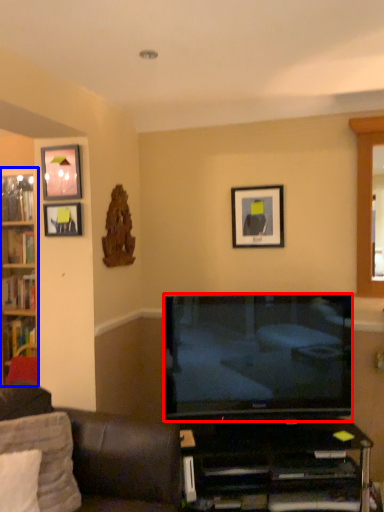
Question: Which point is further to the camera, television (highlighted by a red box) or cabinetry (highlighted by a blue box)?

Choices:
 (A) television
 (B) cabinetry

Answer: (B)